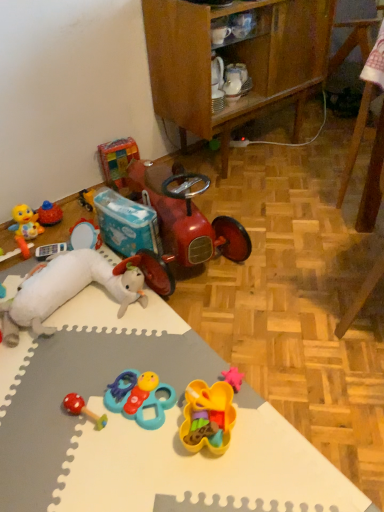
Where is `empty space that is to the right of shiny red toy car at center`? empty space that is to the right of shiny red toy car at center is located at coordinates (291, 230).